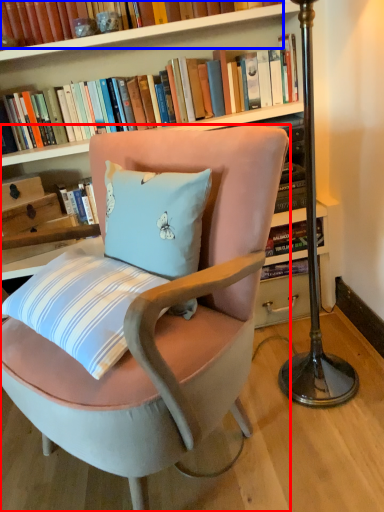
Question: Which point is further to the camera, chair (highlighted by a red box) or book (highlighted by a blue box)?

Choices:
 (A) chair
 (B) book

Answer: (B)